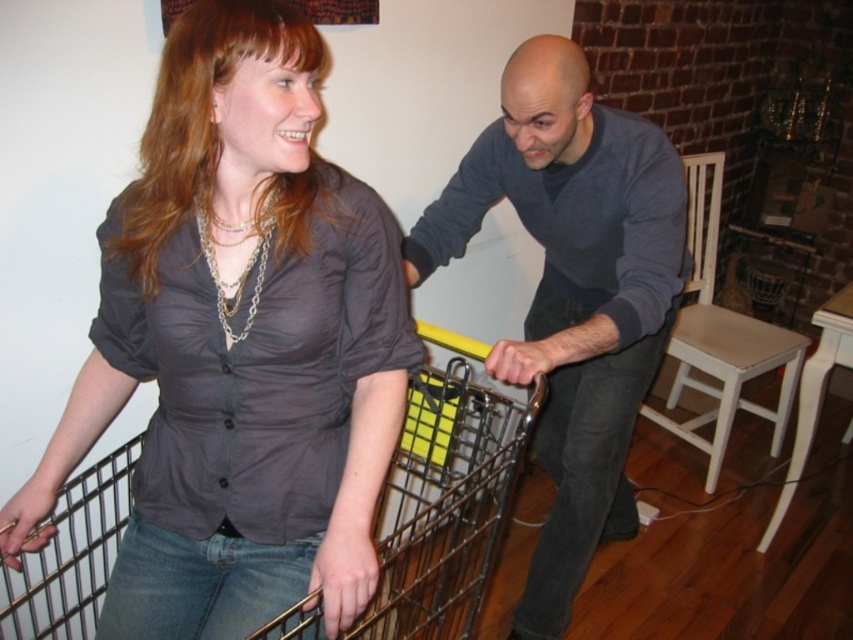
Does matte gray shirt at center appear over white wood stool at right?

Correct, matte gray shirt at center is located above white wood stool at right.

Is point (288, 124) positioned behind point (653, 412)?

No.

You are a GUI agent. You are given a task and a screenshot of the screen. Output one action in this format:
    pyautogui.click(x=<x>, y=<y>)
    Task: Click on the matte gray shirt at center
    
    Given the screenshot: What is the action you would take?
    pyautogui.click(x=239, y=346)

Is matte gray shirt at center smaller than metallic wire trolley at center?

Indeed, matte gray shirt at center has a smaller size compared to metallic wire trolley at center.

What do you see at coordinates (239, 346) in the screenshot? I see `matte gray shirt at center` at bounding box center [239, 346].

Locate an element on the screen. matte gray shirt at center is located at coordinates (239, 346).

This screenshot has width=853, height=640. In order to click on matte gray shirt at center in this screenshot , I will do `click(239, 346)`.

Is matte gray shirt at center positioned before matte gray sweater at center?

Yes, it is in front of matte gray sweater at center.

Consider the image. Which of these two, matte gray shirt at center or matte gray sweater at center, stands shorter?

With less height is matte gray shirt at center.

From the picture: Who is more distant from viewer, (334, 499) or (570, 104)?

Point (570, 104)

At what (x,y) coordinates should I click in order to perform the action: click on matte gray shirt at center. Please return your answer as a coordinate pair (x, y). Looking at the image, I should click on (239, 346).